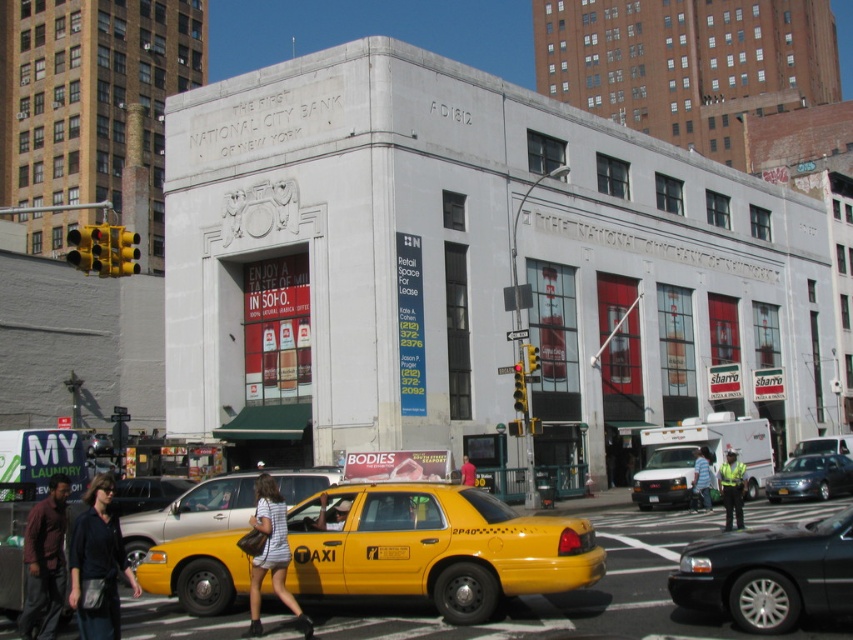
Consider the image. Who is taller, yellow matte taxi cab at center or striped fabric dress at center?

With more height is striped fabric dress at center.

Is yellow matte taxi cab at center shorter than striped fabric dress at center?

Yes, yellow matte taxi cab at center is shorter than striped fabric dress at center.

Does point (151, 529) come in front of point (252, 624)?

No, (151, 529) is behind (252, 624).

You are a GUI agent. You are given a task and a screenshot of the screen. Output one action in this format:
    pyautogui.click(x=<x>, y=<y>)
    Task: Click on the yellow matte taxi cab at center
    Image resolution: width=853 pixels, height=640 pixels.
    Given the screenshot: What is the action you would take?
    pyautogui.click(x=190, y=513)

Is metallic silver taxi cab at lower center taller than denim shorts at center?

Yes.

Is metallic silver taxi cab at lower center further to camera compared to denim shorts at center?

No, it is in front of denim shorts at center.

Is point (160, 504) farther from viewer compared to point (465, 472)?

That is False.

The height and width of the screenshot is (640, 853). Find the location of `metallic silver taxi cab at lower center`. metallic silver taxi cab at lower center is located at coordinates click(146, 492).

Can you confirm if dark blue fabric jacket at lower left is positioned above striped fabric dress at center?

Indeed, dark blue fabric jacket at lower left is positioned over striped fabric dress at center.

What do you see at coordinates (97, 564) in the screenshot?
I see `dark blue fabric jacket at lower left` at bounding box center [97, 564].

This screenshot has width=853, height=640. Find the location of `dark blue fabric jacket at lower left`. dark blue fabric jacket at lower left is located at coordinates (97, 564).